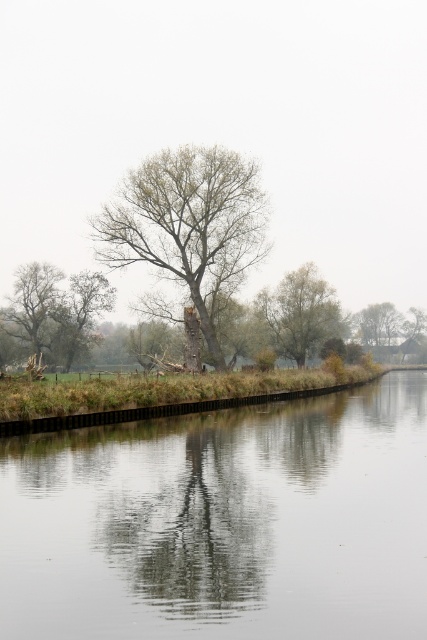
Can you confirm if green leafy tree at center is bigger than green matte tree at center?

Yes.

Between green leafy tree at center and green matte tree at center, which one appears on the right side from the viewer's perspective?

From the viewer's perspective, green matte tree at center appears more on the right side.

Locate an element on the screen. The height and width of the screenshot is (640, 427). green leafy tree at center is located at coordinates (189, 227).

Between point (280, 328) and point (49, 289), which one is positioned in front?

Point (280, 328) is in front.

Between green matte tree at center and green leafy tree at left, which one appears on the left side from the viewer's perspective?

green leafy tree at left is more to the left.

Locate an element on the screen. green matte tree at center is located at coordinates (300, 314).

Between smooth concrete river at center and green matte tree at center, which one appears on the left side from the viewer's perspective?

smooth concrete river at center is more to the left.

The width and height of the screenshot is (427, 640). What do you see at coordinates (224, 524) in the screenshot?
I see `smooth concrete river at center` at bounding box center [224, 524].

Who is more forward, [233,493] or [292,332]?

Point [233,493] is in front.

This screenshot has width=427, height=640. I want to click on smooth concrete river at center, so click(x=224, y=524).